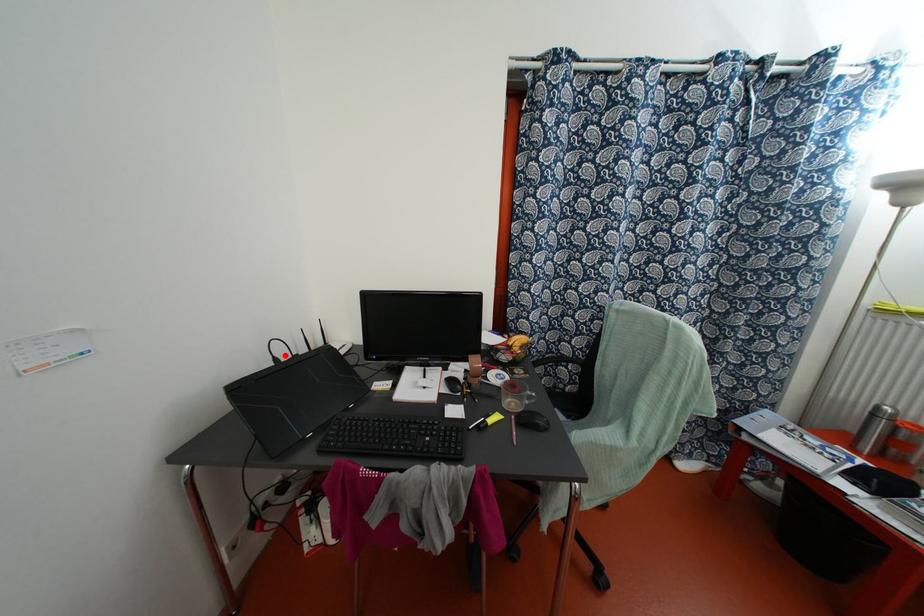
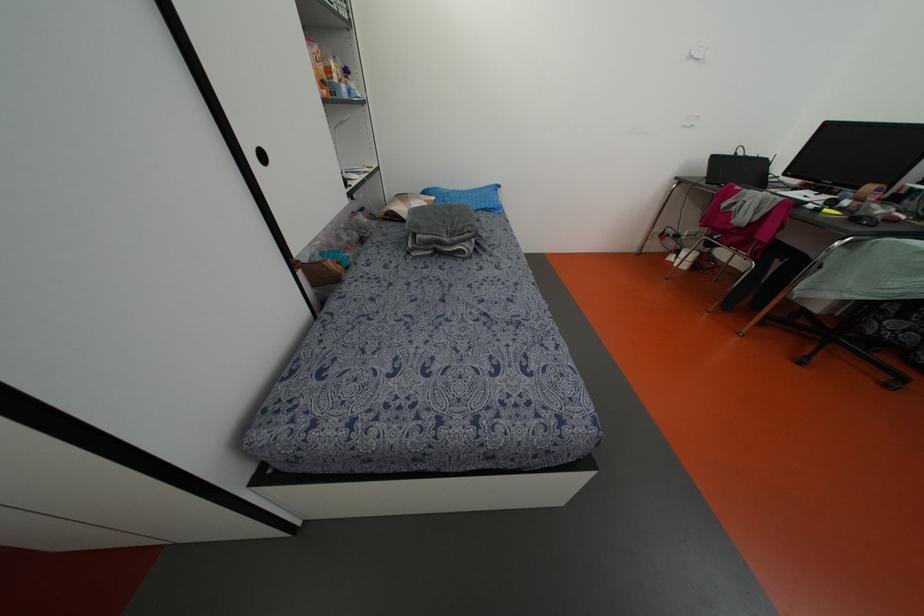
Find the pixel in the second image that matches the highlighted location in the first image.

(739, 153)